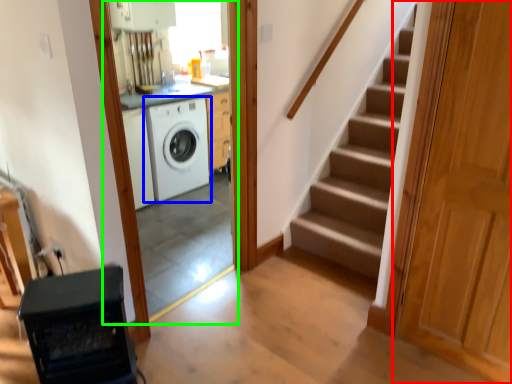
Question: Which object is positioned closest to door (highlighted by a red box)? Select from washing machine (highlighted by a blue box) and screen door (highlighted by a green box).

Choices:
 (A) washing machine
 (B) screen door

Answer: (B)